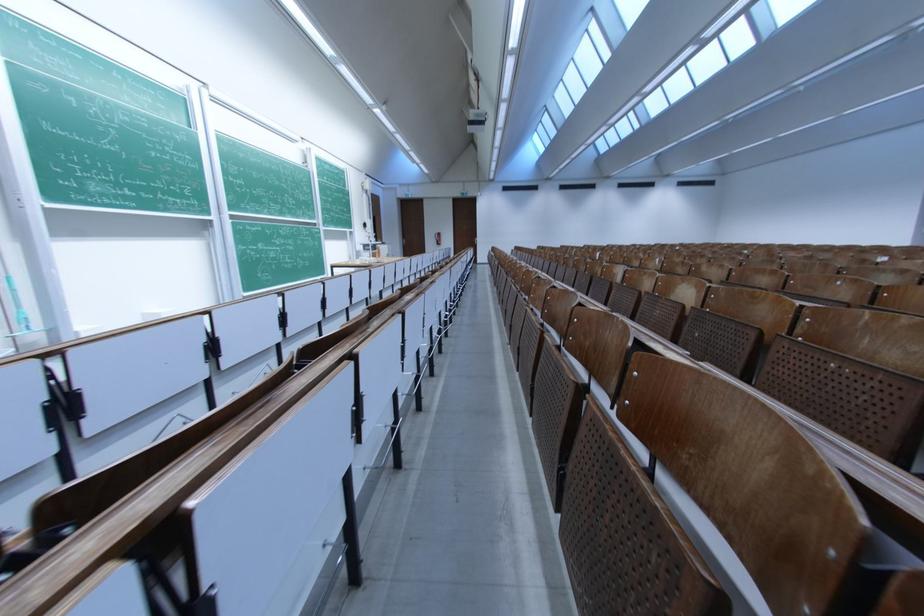
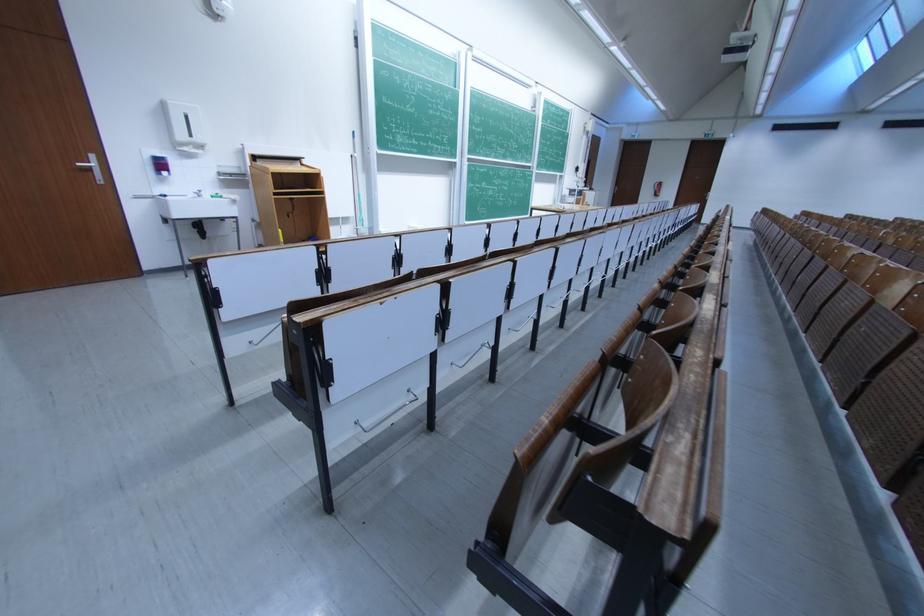
Question: The camera is either moving clockwise (left) or counter-clockwise (right) around the object. The first image is from the beginning of the video and the second image is from the end. Is the camera moving left or right when shooting the video?

Choices:
 (A) Left
 (B) Right

Answer: (B)